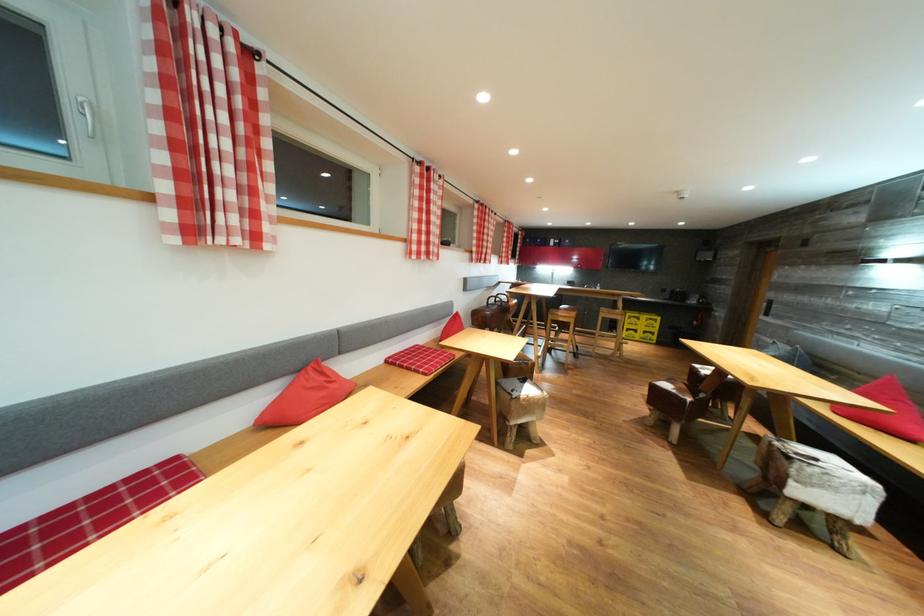
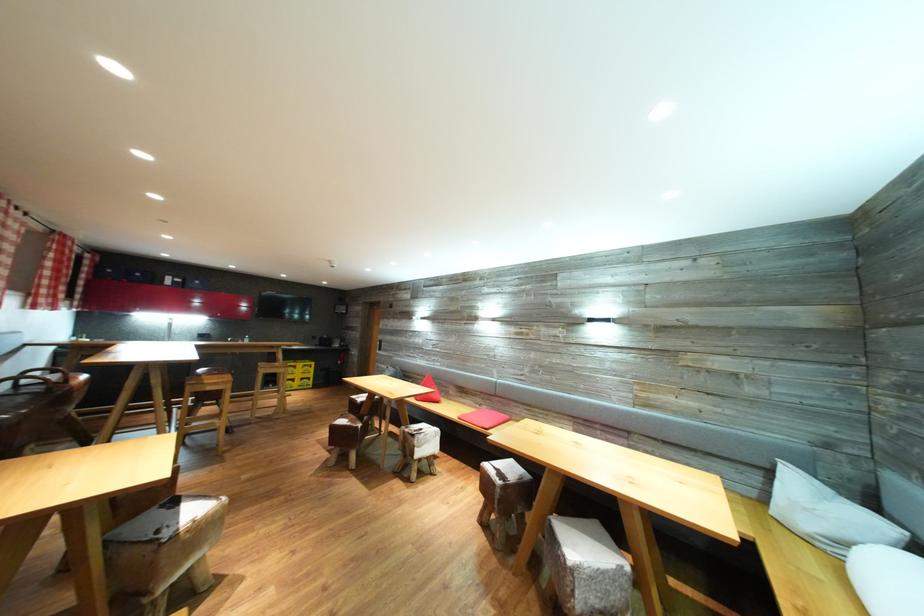
Question: How did the camera likely rotate?

Choices:
 (A) Left
 (B) Right
 (C) Up
 (D) Down

Answer: (B)